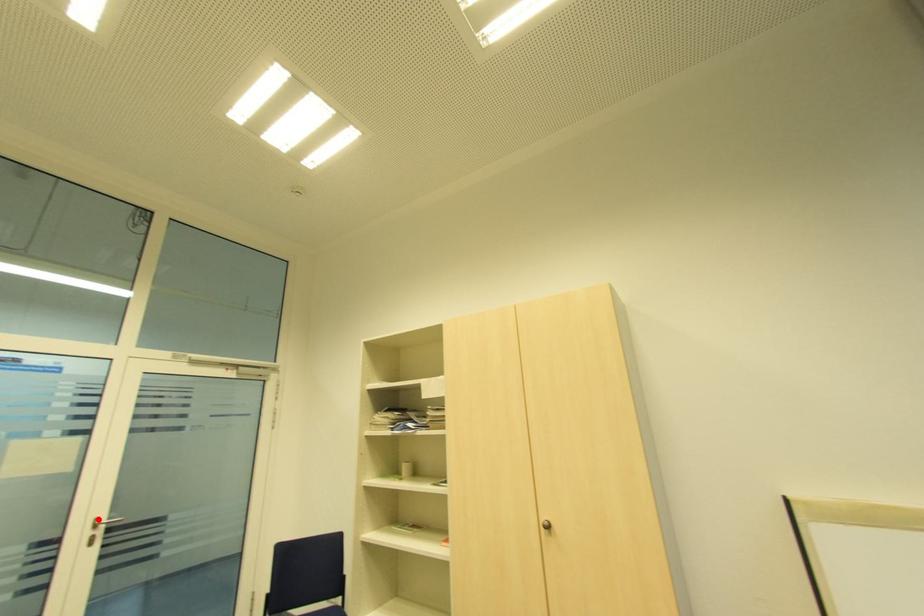
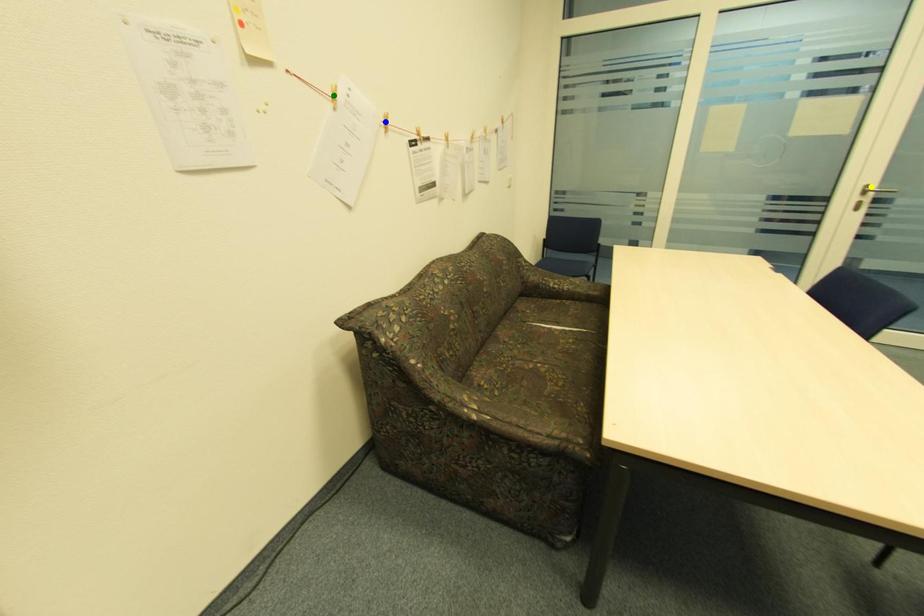
Question: I am providing you with two images of the same scene from different viewpoints. A red point is marked on the first image. You are given multiple points on the second image. Which point in image 2 is actually the same real-world point as the red point in image 1?

Choices:
 (A) yellow point
 (B) blue point
 (C) green point

Answer: (A)